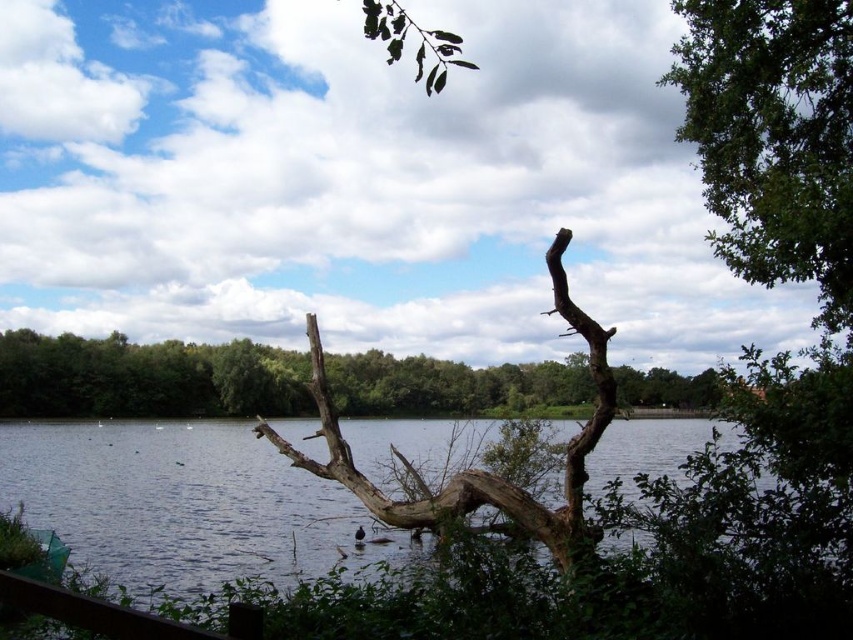
Question: Can you confirm if brown rough tree trunk at center is bigger than brown rough wood at center?

Choices:
 (A) yes
 (B) no

Answer: (A)

Question: Which point is farther to the camera?

Choices:
 (A) (556, 310)
 (B) (373, 406)
 (C) (846, 248)

Answer: (B)

Question: Is brown rough tree trunk at center in front of brown rough wood at center?

Choices:
 (A) no
 (B) yes

Answer: (B)

Question: Can you confirm if green leafy tree at upper right is smaller than brown rough tree trunk at center?

Choices:
 (A) yes
 (B) no

Answer: (A)

Question: Which object is farther from the camera taking this photo?

Choices:
 (A) brown rough tree trunk at center
 (B) green leafy tree at upper right
 (C) brown wood water at center
 (D) brown rough wood at center

Answer: (D)

Question: Estimate the real-world distances between objects in this image. Which object is closer to the brown rough tree trunk at center?

Choices:
 (A) brown rough wood at center
 (B) brown wood water at center

Answer: (B)